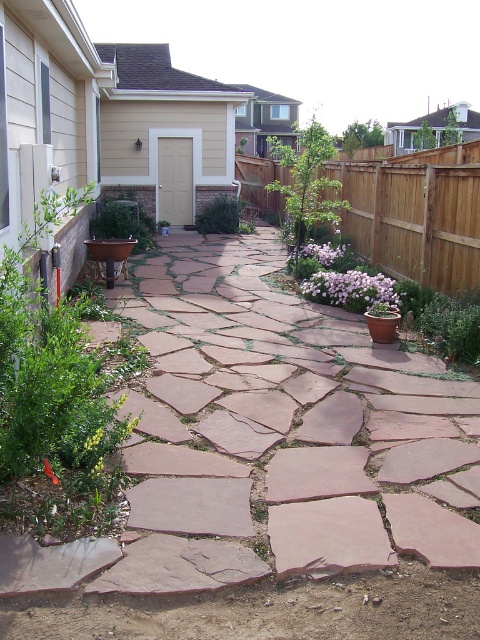
Does green leafy plant at left have a lesser height compared to pink matte flower at center?

Incorrect, green leafy plant at left's height does not fall short of pink matte flower at center's.

Does point (93, 228) come closer to viewer compared to point (339, 256)?

No, it is not.

Which is in front, point (115, 227) or point (330, 244)?

Point (330, 244)

Where is `green leafy plant at left`? The image size is (480, 640). green leafy plant at left is located at coordinates (122, 224).

Is point (301, 284) less distant than point (241, 227)?

Yes, point (301, 284) is closer to viewer.

Which is above, white matte flower at center or green leafy plant at center?

Positioned higher is green leafy plant at center.

The image size is (480, 640). Identify the location of white matte flower at center. (350, 289).

Which of these two, brown wooden fence at upper right or green leafy plant at center, stands shorter?

green leafy plant at center

Between brown wooden fence at upper right and green leafy plant at center, which one is positioned lower?

green leafy plant at center is below.

Where is `brown wooden fence at upper right`? brown wooden fence at upper right is located at coordinates (416, 212).